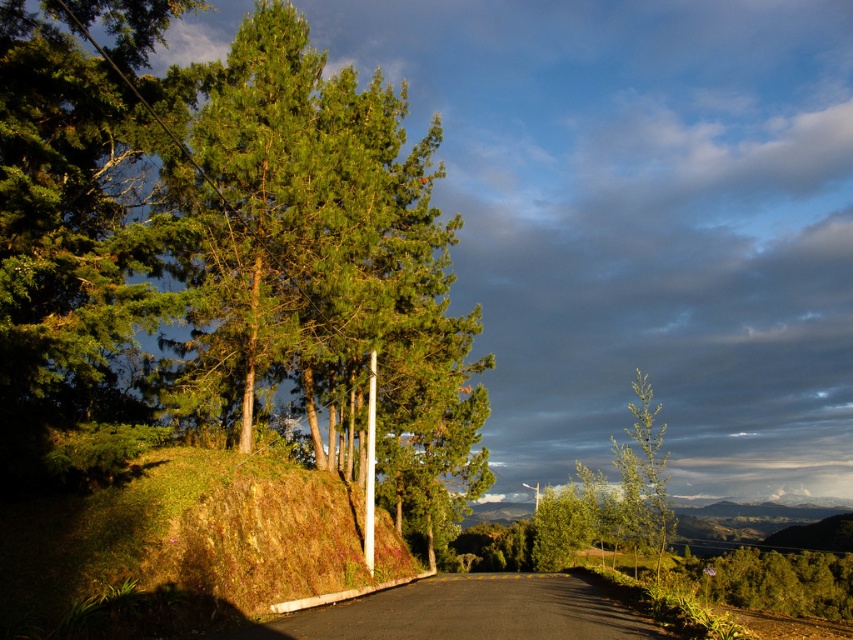
Does point (85, 573) come in front of point (634, 417)?

Yes, point (85, 573) is in front of point (634, 417).

Does green mossy hillside at left appear under green leafy tree at right?

No, green mossy hillside at left is not below green leafy tree at right.

Does point (114, 545) lie behind point (647, 524)?

That is False.

The image size is (853, 640). Identify the location of green mossy hillside at left. (177, 547).

Can you confirm if green glossy tree at upper left is positioned to the right of black asphalt road at center?

No, green glossy tree at upper left is not to the right of black asphalt road at center.

Can you confirm if green glossy tree at upper left is positioned to the left of black asphalt road at center?

Yes, green glossy tree at upper left is to the left of black asphalt road at center.

Is point (444, 422) less distant than point (386, 625)?

That is False.

Identify the location of green glossy tree at upper left. The image size is (853, 640). pos(222,246).

Locate an element on the screen. This screenshot has width=853, height=640. green glossy tree at upper left is located at coordinates (222, 246).

Does green glossy tree at upper left appear over green mossy hillside at left?

Yes, green glossy tree at upper left is above green mossy hillside at left.

Which is behind, point (445, 264) or point (32, 611)?

Positioned behind is point (445, 264).

Locate an element on the screen. The image size is (853, 640). green glossy tree at upper left is located at coordinates (222, 246).